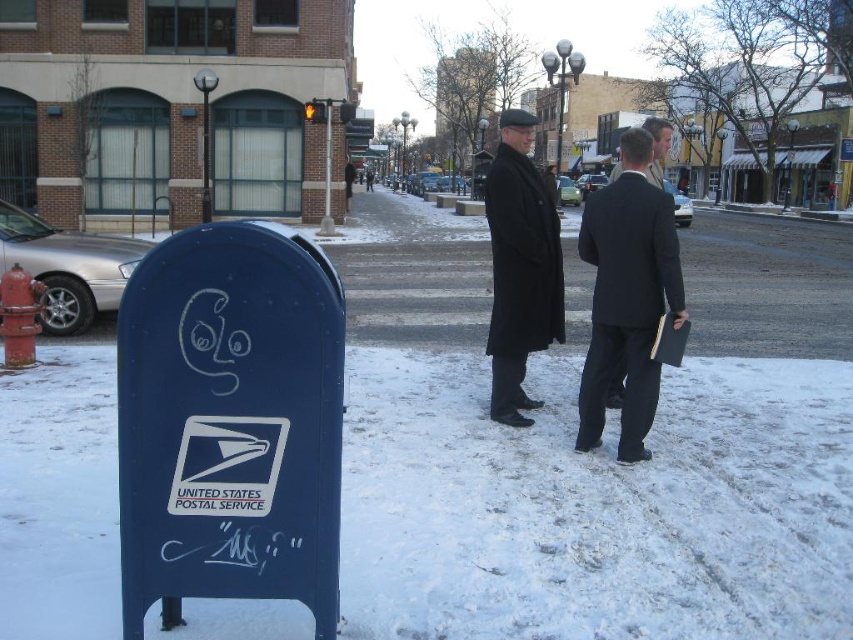
Question: Does blue painted metal mailbox at lower left have a smaller size compared to black matte suit at center?

Choices:
 (A) no
 (B) yes

Answer: (B)

Question: Which point is farther to the camera?

Choices:
 (A) (619, 272)
 (B) (126, 609)

Answer: (A)

Question: Which is farther from the black matte suit at center?

Choices:
 (A) blue painted metal mailbox at lower left
 (B) black wool coat at center

Answer: (A)

Question: Can you confirm if black matte suit at center is positioned above black wool coat at center?

Choices:
 (A) no
 (B) yes

Answer: (A)

Question: From the image, what is the correct spatial relationship of blue painted metal mailbox at lower left in relation to black wool coat at center?

Choices:
 (A) right
 (B) left

Answer: (B)

Question: Which of the following is the closest to the observer?

Choices:
 (A) (640, 323)
 (B) (534, 225)

Answer: (A)